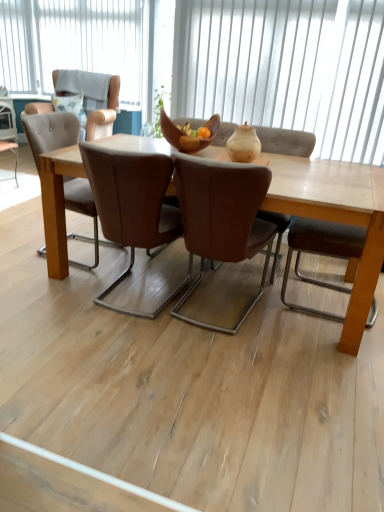
Find the location of a particular element. The height and width of the screenshot is (512, 384). vacant area to the right of brown leather chair at center, which is counted as the 1th chair, starting from the right is located at coordinates (297, 322).